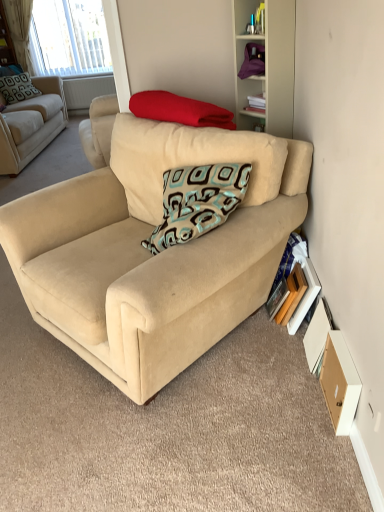
Image resolution: width=384 pixels, height=512 pixels. I want to click on free area in between beige velvety couch at center, positioned as the first studio couch in front-to-back order, and wooden drawer at lower right, so click(265, 407).